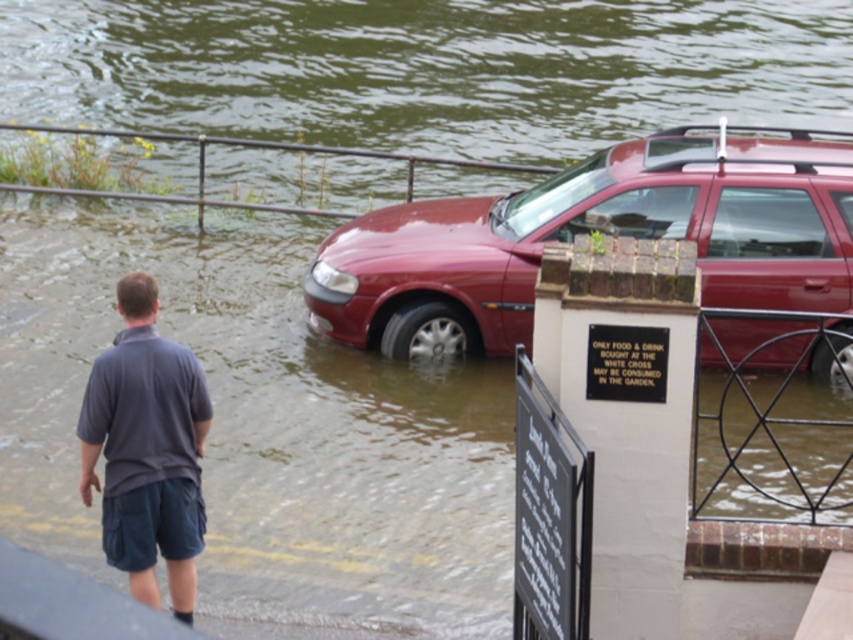
Question: Which of these objects is positioned farthest from the brushed metal rail at upper center?

Choices:
 (A) black metal sign at center
 (B) shiny red car at center
 (C) black stone sign at lower right
 (D) dark gray cotton shirt at lower left

Answer: (A)

Question: Is black stone sign at lower right below brushed metal rail at upper center?

Choices:
 (A) no
 (B) yes

Answer: (B)

Question: Is shiny red car at center below dark gray cotton shirt at lower left?

Choices:
 (A) no
 (B) yes

Answer: (A)

Question: Which is farther from the black stone sign at lower right?

Choices:
 (A) brushed metal rail at upper center
 (B) shiny red car at center
 (C) black metal sign at center
 (D) dark gray cotton shirt at lower left

Answer: (A)

Question: Is black stone sign at lower right below black metal sign at center?

Choices:
 (A) yes
 (B) no

Answer: (A)

Question: Which point is closer to the camera?

Choices:
 (A) dark gray cotton shirt at lower left
 (B) shiny red car at center
 (C) black metal sign at center
 (D) black stone sign at lower right

Answer: (D)